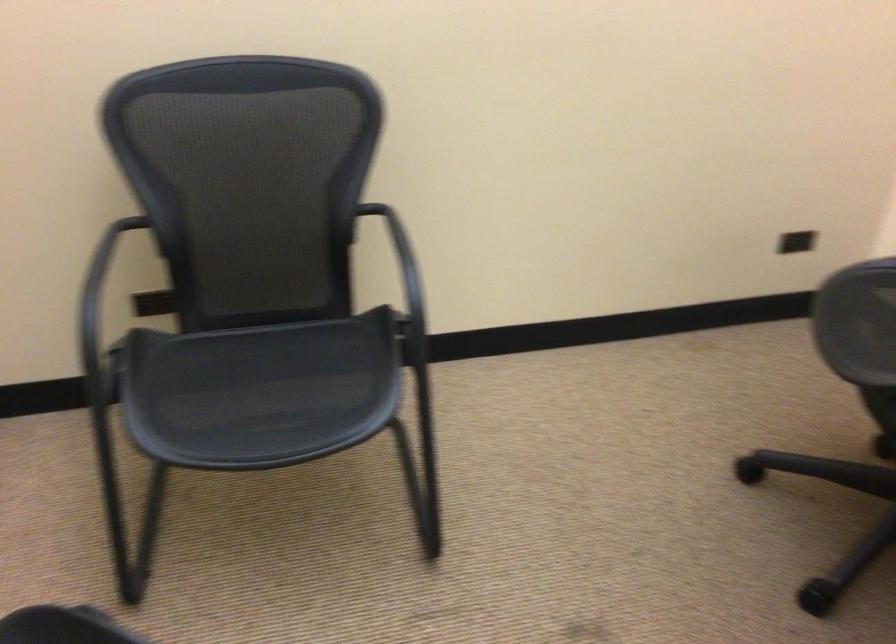
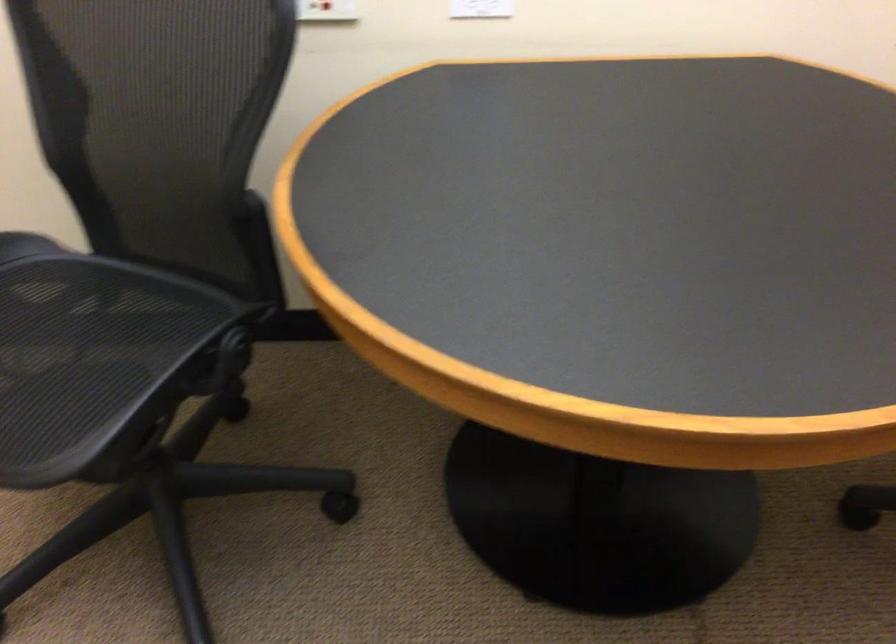
Based on the continuous images, in which direction is the camera rotating?

Answer: The camera rotated toward right-down.